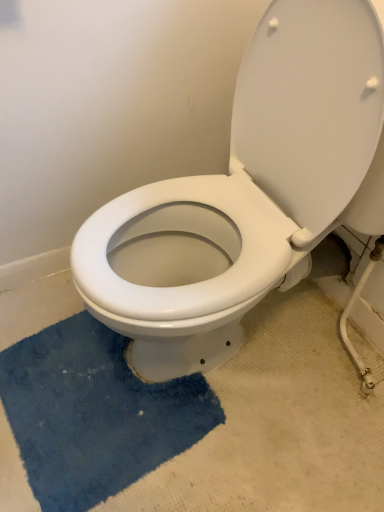
The width and height of the screenshot is (384, 512). In order to click on vacant space in blue plush bath mat at lower left (from a real-world perspective) in this screenshot , I will do `click(69, 428)`.